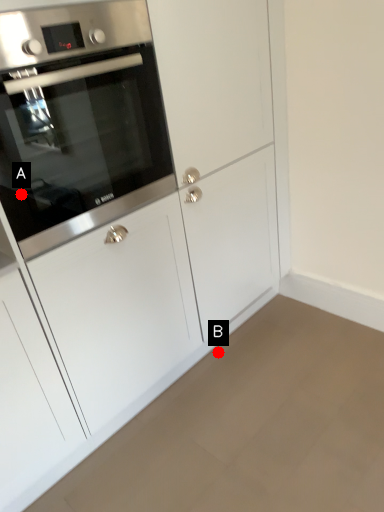
Question: Two points are circled on the image, labeled by A and B beside each circle. Which point appears closest to the camera in this image?

Choices:
 (A) A is closer
 (B) B is closer

Answer: (A)